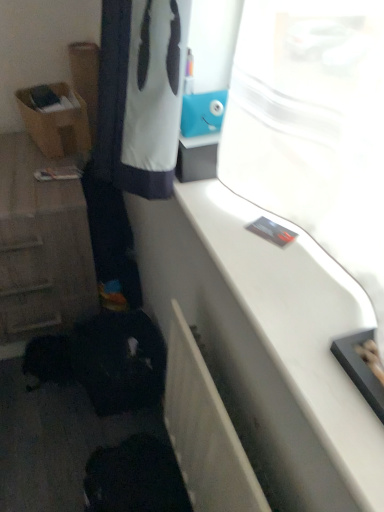
I want to click on blank space situated above wooden cabinet at left (from a real-world perspective), so click(30, 172).